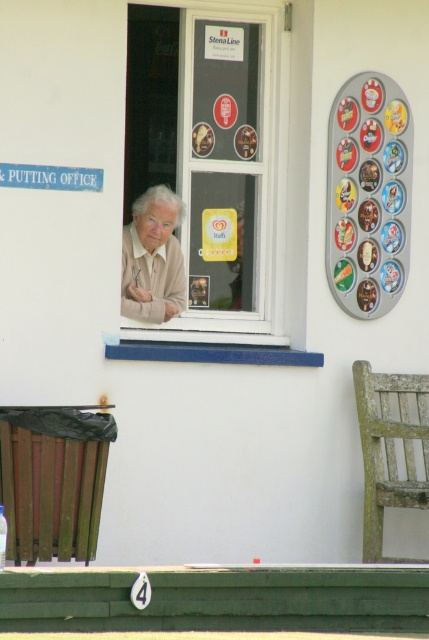
You are a delivery person trying to see if the light beige sweater at center is visible through the white plastic window at center. Can you see it?

The light beige sweater at center is behind the white plastic window at center, so it is not visible through the window.

You are a delivery person standing in front of the building. You need to place a small package on the bench. The bench is next to the white plastic window at center. Is the bench large enough to hold both the package and the light beige sweater at center without overlapping?

The white plastic window at center is bigger than the light beige sweater at center. Since the window is larger, the bench might have enough space for both the package and the sweater, but the exact size of the bench isn not specified. However, since the sweater is smaller than the window, it might fit alongside the package if the bench is at least as wide as the window. Without more details, it is uncertain, but there is a possibility.

You are standing in front of the building with the white exterior and the small blue sign that says PUTTING OFFICE. You notice two points marked on the ground. The first point is at coordinates point (245, 54) and the second point is at point (126, 253). If you are facing the building, which point is closer to the building?

Point (245, 54) is behind point (126, 253), so when facing the building, point (245, 54) is closer to the building.